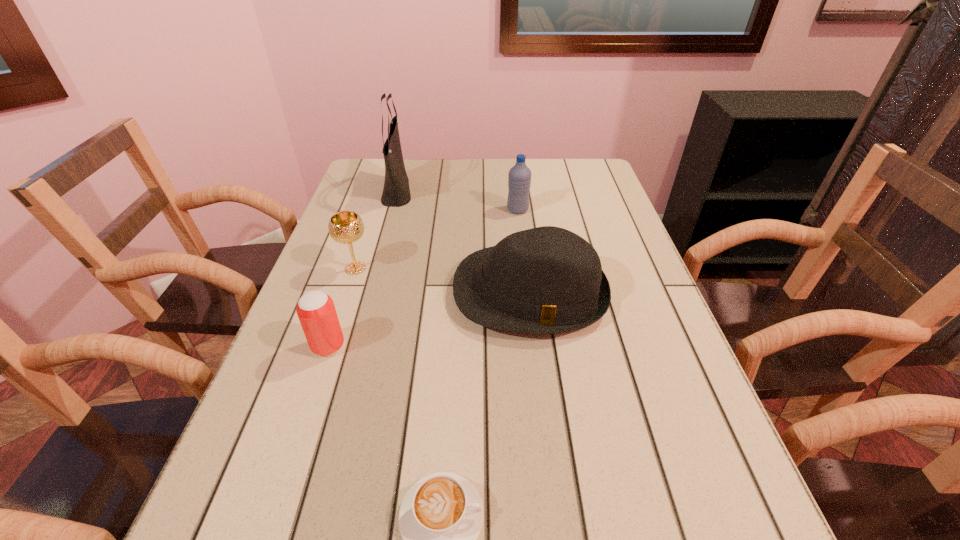
This screenshot has height=540, width=960. Find the location of `shoulder bag`. shoulder bag is located at coordinates pyautogui.click(x=396, y=192).

In order to click on water bottle in this screenshot , I will do pos(519,177).

Find the location of a particular element. The image size is (960, 540). fedora is located at coordinates (547, 280).

Identify the location of chalice. Image resolution: width=960 pixels, height=540 pixels. (346, 227).

Find the location of a particular element. beer can is located at coordinates (316, 311).

Identify the location of blank space located 0.300m on the right of the tallest object. The height and width of the screenshot is (540, 960). (510, 191).

At what (x,y) coordinates should I click in order to perform the action: click on vacant space located 0.200m on the back of the water bottle. Please return your answer as a coordinate pair (x, y). Looking at the image, I should click on (514, 172).

The width and height of the screenshot is (960, 540). Find the location of `free space located on the front-facing side of the fedora`. free space located on the front-facing side of the fedora is located at coordinates (560, 531).

Image resolution: width=960 pixels, height=540 pixels. Identify the location of vacant space located on the right of the chalice. (404, 268).

This screenshot has width=960, height=540. In order to click on free spot located 0.050m on the back of the beer can in this screenshot , I will do `click(338, 316)`.